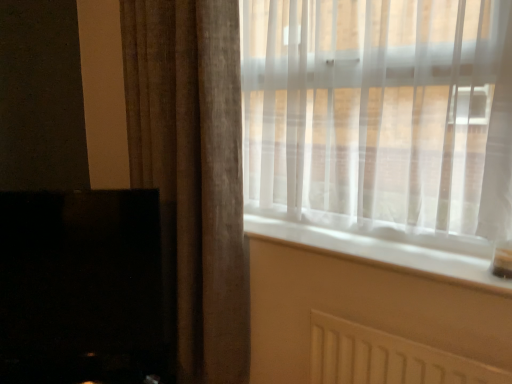
This screenshot has width=512, height=384. What do you see at coordinates (192, 173) in the screenshot?
I see `brown textured curtain at left` at bounding box center [192, 173].

The width and height of the screenshot is (512, 384). I want to click on white smooth window sill at center, so click(x=382, y=243).

Could you tell me if brown textured curtain at left is facing white smooth window sill at center?

No, brown textured curtain at left is not oriented towards white smooth window sill at center.

Who is bigger, brown textured curtain at left or white smooth window sill at center?

Bigger between the two is brown textured curtain at left.

Who is more distant, brown textured curtain at left or white smooth window sill at center?

brown textured curtain at left is behind.

From a real-world perspective, who is located lower, brown textured curtain at left or white smooth window sill at center?

From a 3D spatial view, white smooth window sill at center is below.

Image resolution: width=512 pixels, height=384 pixels. I want to click on window that appears above the brown textured curtain at left (from the image's perspective), so click(381, 116).

From the image's perspective, is translucent fabric window at upper right positioned above or below brown textured curtain at left?

translucent fabric window at upper right is above brown textured curtain at left.

Considering the sizes of translucent fabric window at upper right and brown textured curtain at left in the image, is translucent fabric window at upper right taller or shorter than brown textured curtain at left?

In the image, translucent fabric window at upper right appears to be shorter than brown textured curtain at left.

Is point (60, 321) closer or farther from the camera than point (242, 356)?

Point (60, 321) appears to be closer to the viewer than point (242, 356).

Would you say black glossy fireplace at lower left contains brown textured curtain at left?

No, brown textured curtain at left is not a part of black glossy fireplace at lower left.

Is black glossy fireplace at lower left in front of or behind brown textured curtain at left in the image?

black glossy fireplace at lower left is positioned farther from the viewer than brown textured curtain at left.

Between black glossy fireplace at lower left and brown textured curtain at left, which one has more height?

Standing taller between the two is brown textured curtain at left.

Is point (160, 326) farther from camera compared to point (398, 234)?

Yes, point (160, 326) is behind point (398, 234).

Which of these two, black glossy fireplace at lower left or white smooth window sill at center, stands shorter?

white smooth window sill at center is shorter.

Measure the distance from black glossy fireplace at lower left to white smooth window sill at center.

black glossy fireplace at lower left and white smooth window sill at center are 25.14 inches apart.

Is black glossy fireplace at lower left positioned with its back to white smooth window sill at center?

black glossy fireplace at lower left is not turned away from white smooth window sill at center.

Does white smooth window sill at center touch black glossy fireplace at lower left?

white smooth window sill at center and black glossy fireplace at lower left are clearly separated.

In terms of width, does white smooth window sill at center look wider or thinner when compared to black glossy fireplace at lower left?

white smooth window sill at center is wider than black glossy fireplace at lower left.

What's the angular difference between white smooth window sill at center and black glossy fireplace at lower left's facing directions?

There is a 42.3-degree angle between the facing directions of white smooth window sill at center and black glossy fireplace at lower left.

Is black glossy fireplace at lower left positioned far away from translucent fabric window at upper right?

No, black glossy fireplace at lower left is in close proximity to translucent fabric window at upper right.

Which point is more forward, (124, 228) or (438, 11)?

The point (438, 11) is more forward.

Considering the sizes of black glossy fireplace at lower left and translucent fabric window at upper right in the image, is black glossy fireplace at lower left taller or shorter than translucent fabric window at upper right?

Considering their sizes, black glossy fireplace at lower left has less height than translucent fabric window at upper right.

Looking at this image, is black glossy fireplace at lower left facing away from translucent fabric window at upper right?

black glossy fireplace at lower left does not have its back to translucent fabric window at upper right.

Is translucent fabric window at upper right positioned far away from white smooth window sill at center?

Actually, translucent fabric window at upper right and white smooth window sill at center are a little close together.

Is translucent fabric window at upper right facing towards white smooth window sill at center?

No, translucent fabric window at upper right is not turned towards white smooth window sill at center.

Which point is more distant from viewer, (415,142) or (465,269)?

Point (415,142)

How different are the orientations of translucent fabric window at upper right and white smooth window sill at center in degrees?

The angle between the facing direction of translucent fabric window at upper right and the facing direction of white smooth window sill at center is 0.0735 degrees.

Identify the location of window sill in front of the brown textured curtain at left. This screenshot has height=384, width=512. tap(382, 243).

In the image, there is a translucent fabric window at upper right. Where is `curtain below it (from the image's perspective)`? The image size is (512, 384). curtain below it (from the image's perspective) is located at coordinates (192, 173).

Consider the image. When comparing their distances from black glossy fireplace at lower left, does white smooth window sill at center or translucent fabric window at upper right seem further?

translucent fabric window at upper right lies further to black glossy fireplace at lower left than the other object.

Looking at the image, which one is located further to brown textured curtain at left, white smooth window sill at center or black glossy fireplace at lower left?

Based on the image, white smooth window sill at center appears to be further to brown textured curtain at left.

Estimate the real-world distances between objects in this image. Which object is closer to translucent fabric window at upper right, brown textured curtain at left or black glossy fireplace at lower left?

Based on the image, brown textured curtain at left appears to be nearer to translucent fabric window at upper right.

Based on their spatial positions, is black glossy fireplace at lower left or brown textured curtain at left closer to white smooth window sill at center?

brown textured curtain at left lies closer to white smooth window sill at center than the other object.

When comparing their distances from translucent fabric window at upper right, does white smooth window sill at center or black glossy fireplace at lower left seem further?

black glossy fireplace at lower left is positioned further to the anchor translucent fabric window at upper right.

Looking at this image, looking at the image, which one is located closer to brown textured curtain at left, translucent fabric window at upper right or black glossy fireplace at lower left?

black glossy fireplace at lower left is positioned closer to the anchor brown textured curtain at left.

When comparing their distances from black glossy fireplace at lower left, does brown textured curtain at left or white smooth window sill at center seem closer?

brown textured curtain at left.

Based on their spatial positions, is black glossy fireplace at lower left or translucent fabric window at upper right further from white smooth window sill at center?

black glossy fireplace at lower left is positioned further to the anchor white smooth window sill at center.

Locate an element on the screen. Image resolution: width=512 pixels, height=384 pixels. window sill between brown textured curtain at left and translucent fabric window at upper right is located at coordinates (382, 243).

Find the location of a particular element. curtain between black glossy fireplace at lower left and translucent fabric window at upper right is located at coordinates (192, 173).

The height and width of the screenshot is (384, 512). I want to click on window sill situated between black glossy fireplace at lower left and translucent fabric window at upper right from left to right, so click(382, 243).

Find the location of a particular element. The height and width of the screenshot is (384, 512). curtain situated between black glossy fireplace at lower left and white smooth window sill at center from left to right is located at coordinates (192, 173).